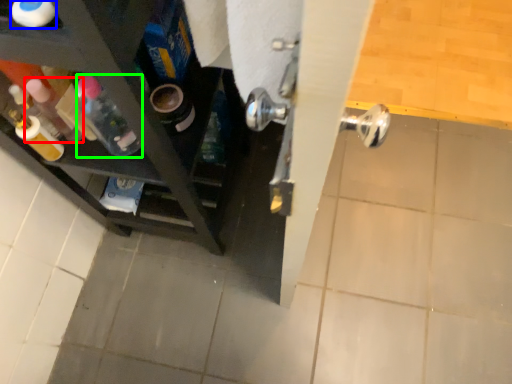
Question: Which object is the closest to the bottle (highlighted by a red box)? Choose among these: bottle (highlighted by a blue box) or bottle (highlighted by a green box).

Choices:
 (A) bottle
 (B) bottle

Answer: (B)